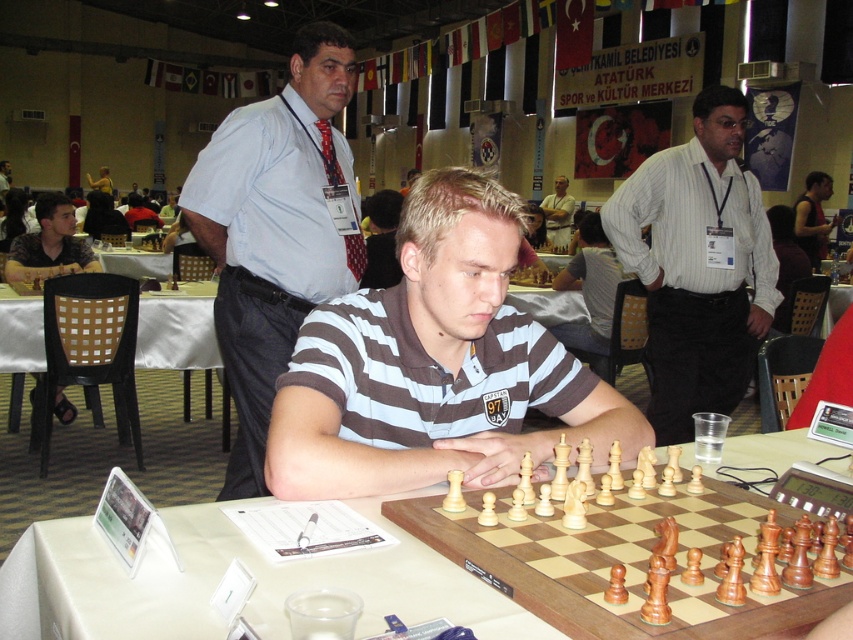
You are a photographer at the chess tournament and need to ensure both the light blue shirt at center and the white striped shirt at center are visible in your photo. Which shirt should you focus on to capture the details of the smaller one?

The light blue shirt at center has a smaller size compared to the white striped shirt at center, so you should focus on the light blue shirt at center to capture its details.

You are a photographer standing at the back of the hall. You want to take a photo of the light blue shirt at center and the white striped shirt at center without any obstructions. Given that your camera has a maximum focus range of 1.5 meters, will you be able to capture both shirts in the same frame without moving closer?

The distance between the light blue shirt at center and the white striped shirt at center is 1.42 meters, which is within the camera maximum focus range of 1.5 meters. Therefore, you can capture both shirts in the same frame without moving closer.